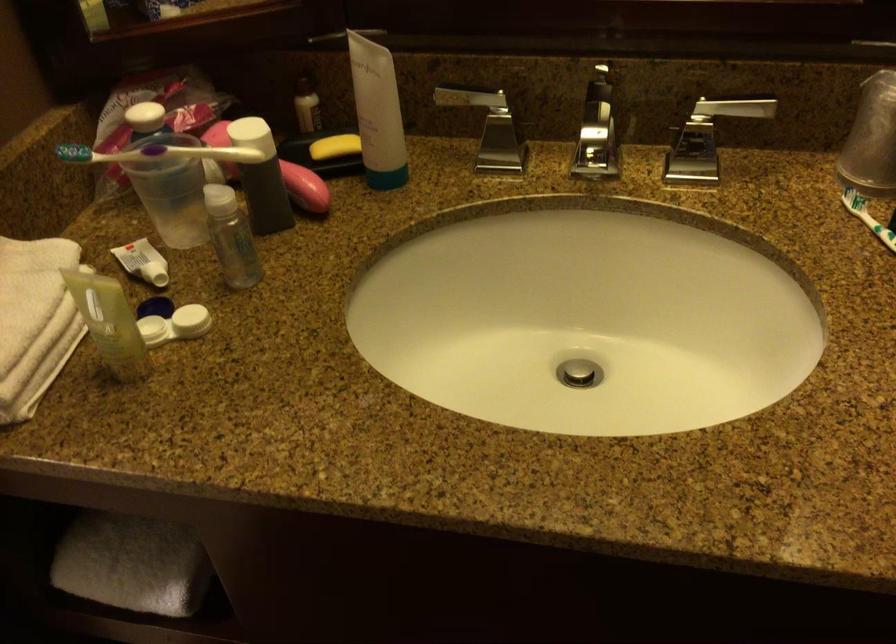
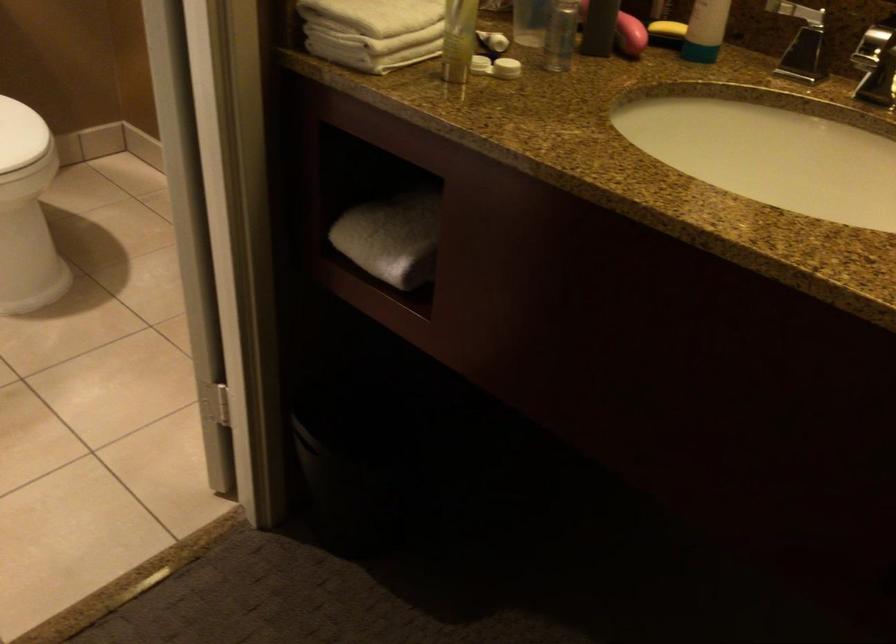
In the second image, find the point that corresponds to point 306,193 in the first image.

(630, 35)